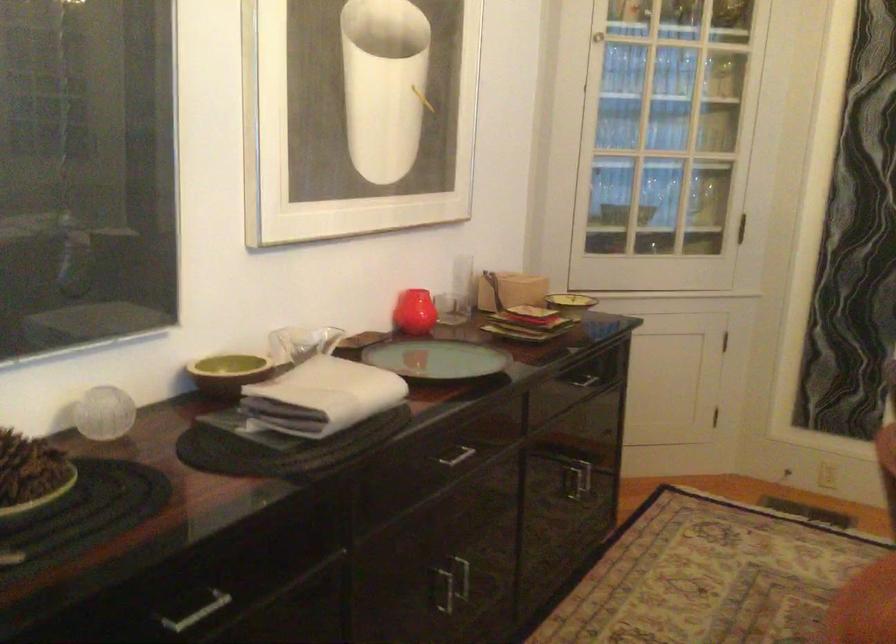
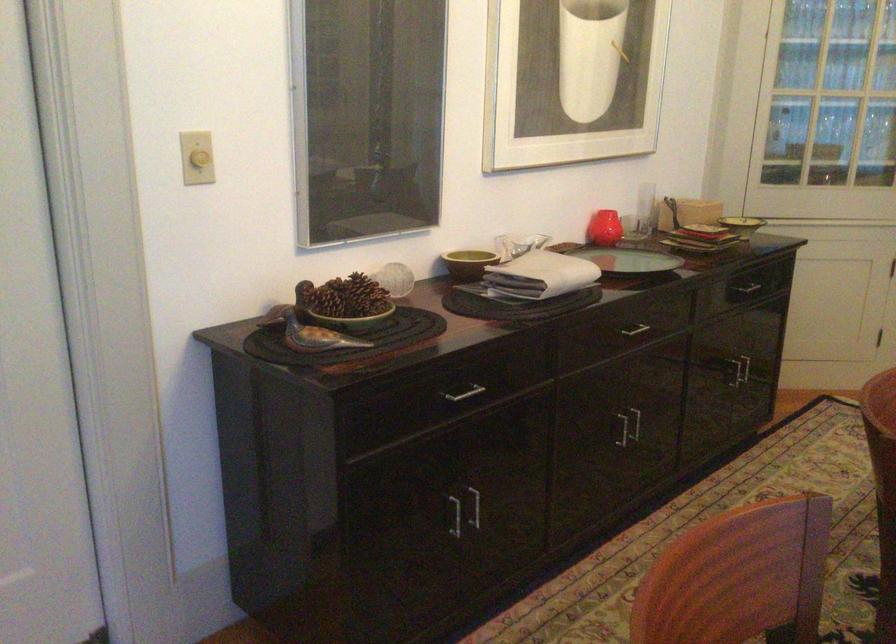
In the second image, find the point that corresponds to (453,283) in the first image.

(645, 207)